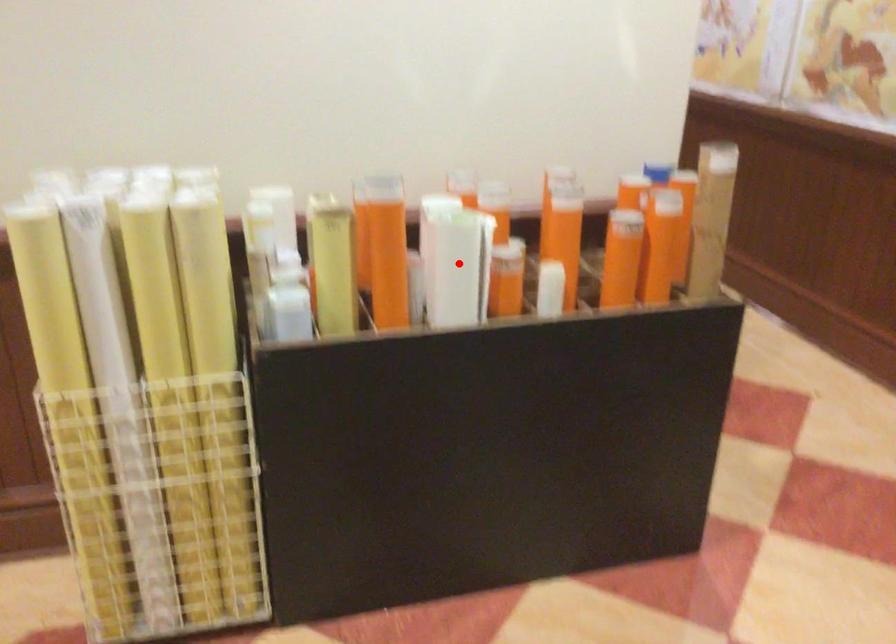
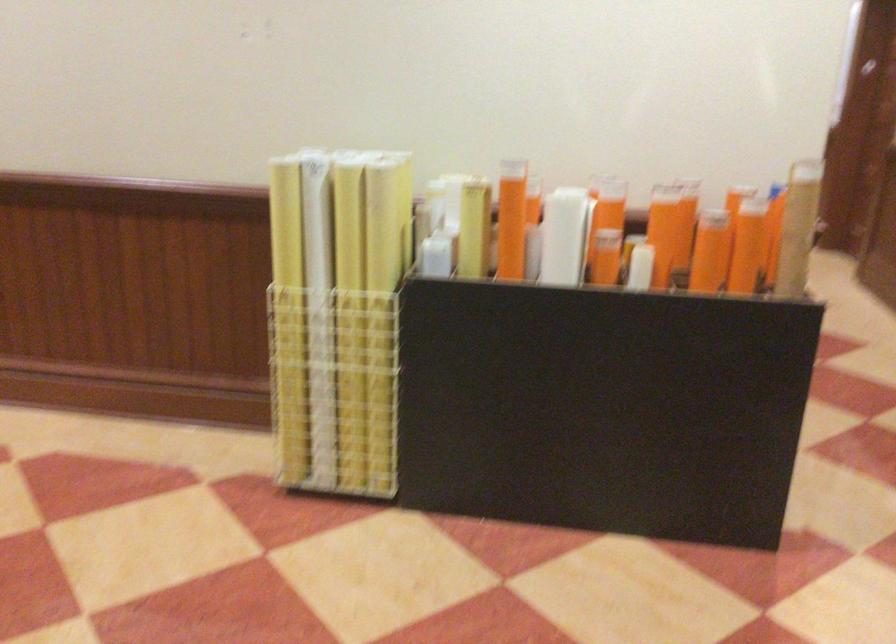
Question: I am providing you with two images of the same scene from different viewpoints. A red point is shown in image1. For the corresponding object point in image2, is it positioned nearer or farther from the camera?

Choices:
 (A) Nearer
 (B) Farther

Answer: (B)